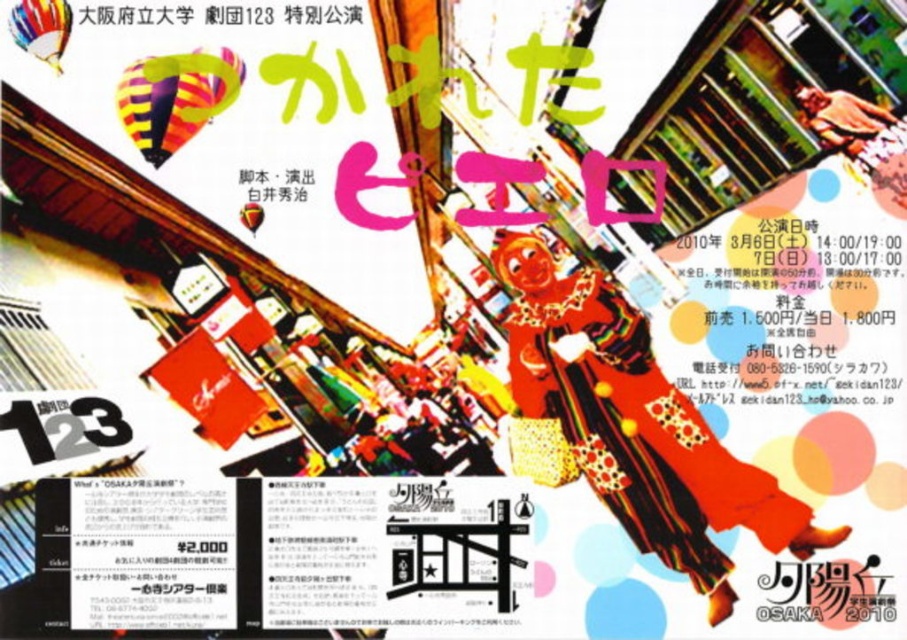
Question: Which point is closer to the camera?

Choices:
 (A) matte red poster at center
 (B) multicolored striped balloon at upper left

Answer: (A)

Question: Which object appears farthest from the camera in this image?

Choices:
 (A) rainbow striped balloon at upper left
 (B) matte red poster at center

Answer: (B)

Question: Can you confirm if multicolored striped balloon at upper left is wider than rainbow striped balloon at upper left?

Choices:
 (A) no
 (B) yes

Answer: (B)

Question: Does matte red poster at center have a smaller size compared to multicolored striped balloon at upper left?

Choices:
 (A) yes
 (B) no

Answer: (B)

Question: Which of these objects is positioned farthest from the multicolored striped balloon at upper left?

Choices:
 (A) rainbow striped balloon at upper left
 (B) matte red poster at center

Answer: (A)

Question: Does matte red poster at center appear on the left side of rainbow striped balloon at upper left?

Choices:
 (A) yes
 (B) no

Answer: (B)